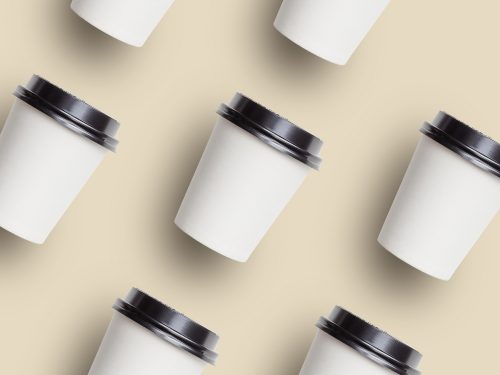
At what (x,y) coordinates should I click in order to perform the action: click on cup. Please return your answer as a coordinate pair (x, y). The height and width of the screenshot is (375, 500). Looking at the image, I should click on (150, 368), (338, 366), (426, 248), (273, 206), (46, 189), (125, 29), (306, 25).